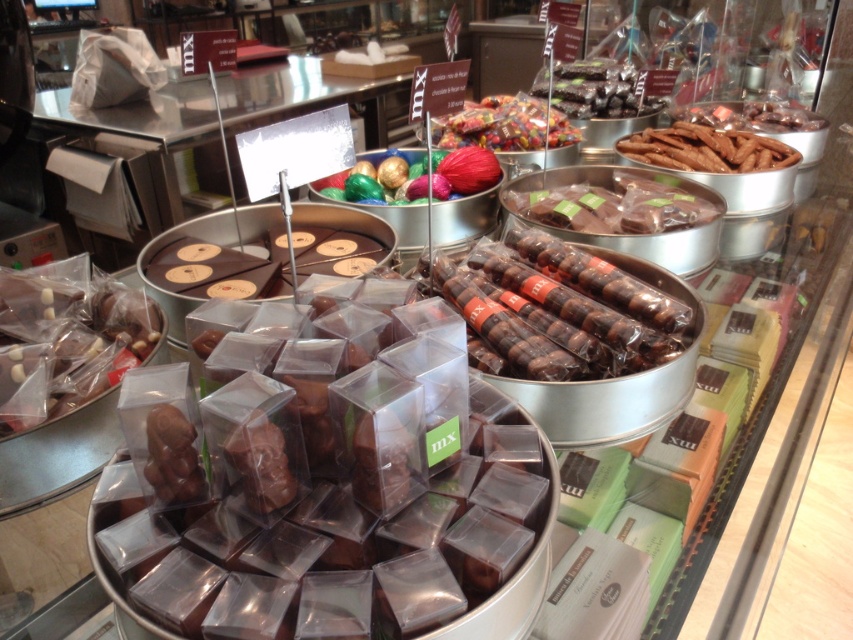
Is point (601, 337) in front of point (581, 68)?

Yes, point (601, 337) is closer to viewer.

Is point (621, 321) positioned after point (560, 93)?

No, (621, 321) is in front of (560, 93).

Locate an element on the screen. This screenshot has height=640, width=853. chocolate-coated truffles at center is located at coordinates (556, 310).

Can you confirm if chocolate-coated truffles at center is positioned below shiny chocolate bar at center?

Yes, chocolate-coated truffles at center is below shiny chocolate bar at center.

Can you confirm if chocolate-coated truffles at center is positioned to the right of shiny chocolate bar at center?

In fact, chocolate-coated truffles at center is to the left of shiny chocolate bar at center.

Between point (653, 356) and point (642, 220), which one is positioned in front?

Point (653, 356)

At what (x,y) coordinates should I click in order to perform the action: click on chocolate-coated truffles at center. Please return your answer as a coordinate pair (x, y). Looking at the image, I should click on (556, 310).

Can you confirm if shiny chocolate bar at center is shorter than brown matte chocolate sticks at upper right?

Indeed, shiny chocolate bar at center has a lesser height compared to brown matte chocolate sticks at upper right.

Between point (611, 214) and point (682, 120), which one is positioned in front?

Point (611, 214) is in front.

Where is `shiny chocolate bar at center`? This screenshot has width=853, height=640. shiny chocolate bar at center is located at coordinates (614, 205).